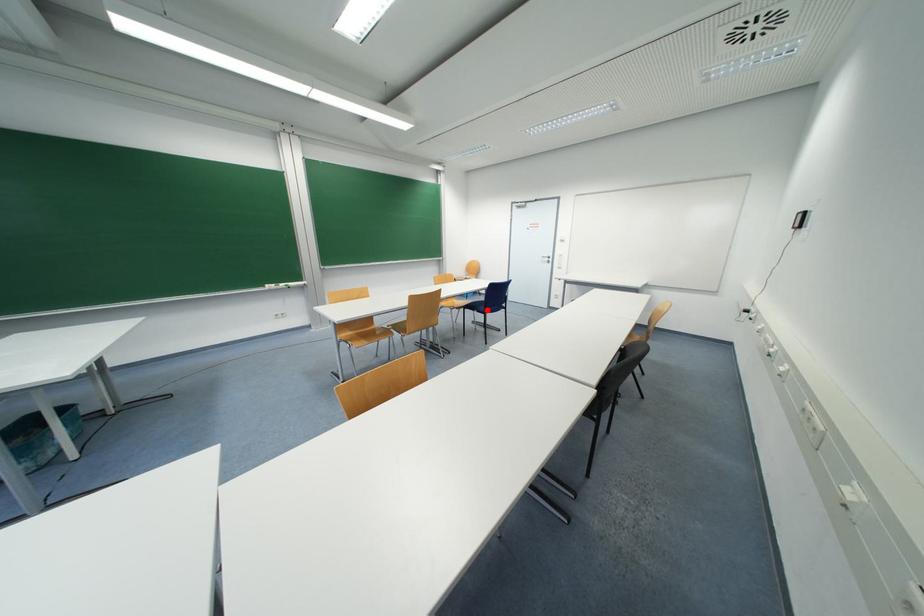
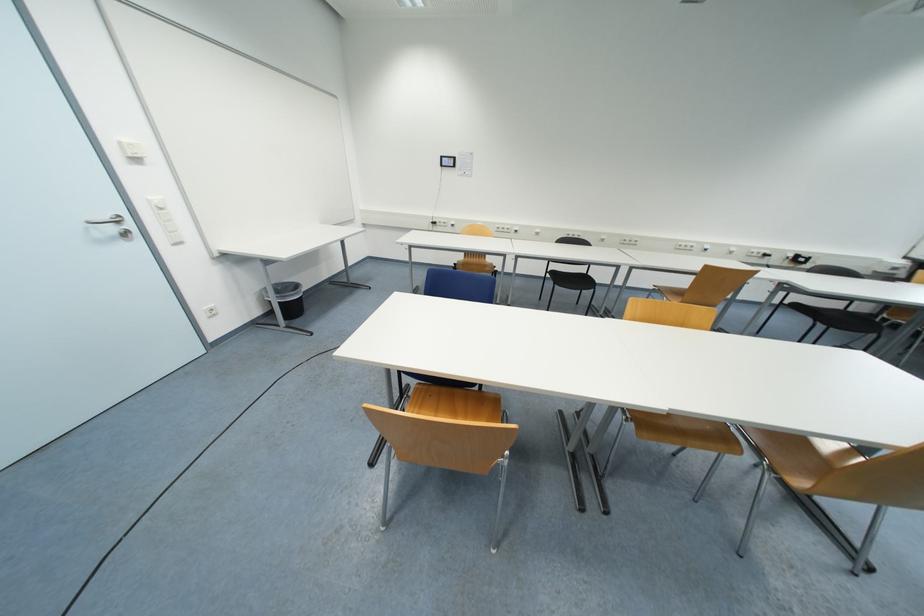
Question: I am providing you with two images of the same scene from different viewpoints. A red point is marked on the first image. Can you still see the location of the red point in image 2?

Choices:
 (A) Yes
 (B) No

Answer: (B)